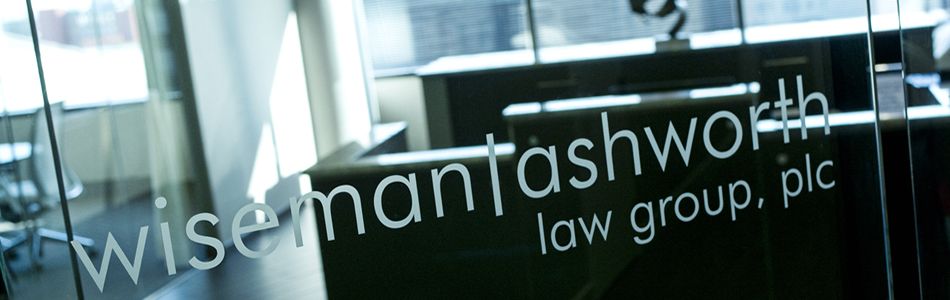
Where is `desk tall surface`? The height and width of the screenshot is (300, 950). desk tall surface is located at coordinates (576, 65).